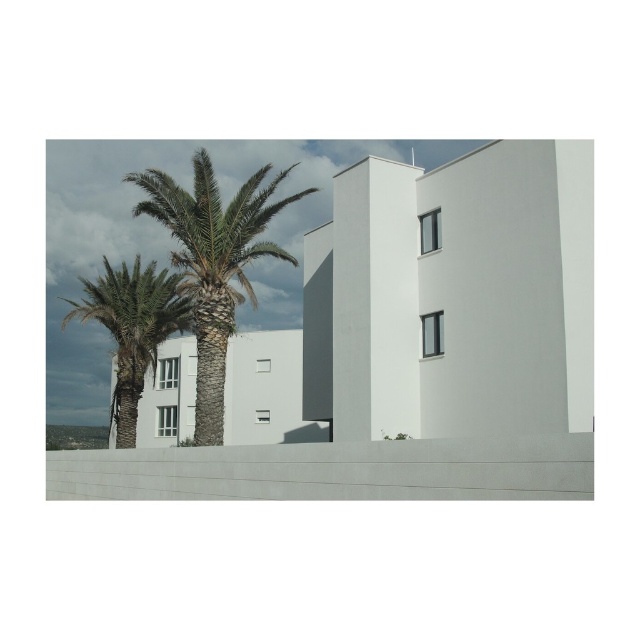
Is green leafy palm tree at center thinner than green leafy palm tree at left?

Indeed, green leafy palm tree at center has a lesser width compared to green leafy palm tree at left.

The width and height of the screenshot is (640, 640). What do you see at coordinates (212, 262) in the screenshot?
I see `green leafy palm tree at center` at bounding box center [212, 262].

Is point (204, 205) in front of point (120, 428)?

Yes.

At what (x,y) coordinates should I click in order to perform the action: click on green leafy palm tree at center. Please return your answer as a coordinate pair (x, y). This screenshot has height=640, width=640. Looking at the image, I should click on (212, 262).